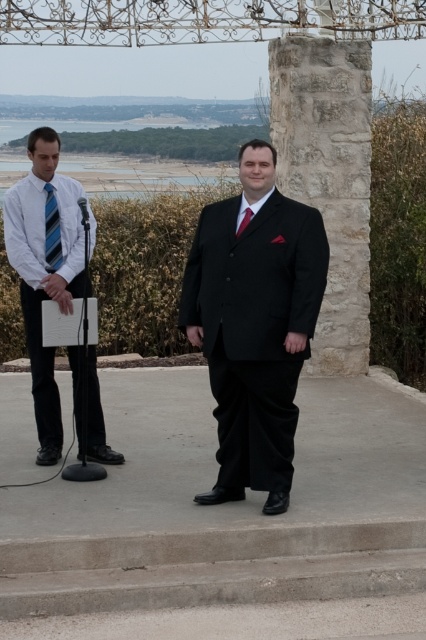
Who is lower down, stone at center or white striped shirt at left?

white striped shirt at left

Is point (368, 300) positioned before point (68, 240)?

No, it is behind (68, 240).

You are a GUI agent. You are given a task and a screenshot of the screen. Output one action in this format:
    pyautogui.click(x=<x>, y=<y>)
    Task: Click on the stone at center
    This screenshot has width=426, height=640.
    Given the screenshot: What is the action you would take?
    pyautogui.click(x=328, y=179)

Does white striped shirt at left lie in front of blue striped tie at left?

Yes, it is.

The width and height of the screenshot is (426, 640). What do you see at coordinates (43, 273) in the screenshot? I see `white striped shirt at left` at bounding box center [43, 273].

Find the location of a particular element. Image resolution: width=426 pixels, height=640 pixels. white striped shirt at left is located at coordinates (43, 273).

Does white striped shirt at left have a larger size compared to shiny red tie at center?

Yes.

Image resolution: width=426 pixels, height=640 pixels. Identify the location of white striped shirt at left. (43, 273).